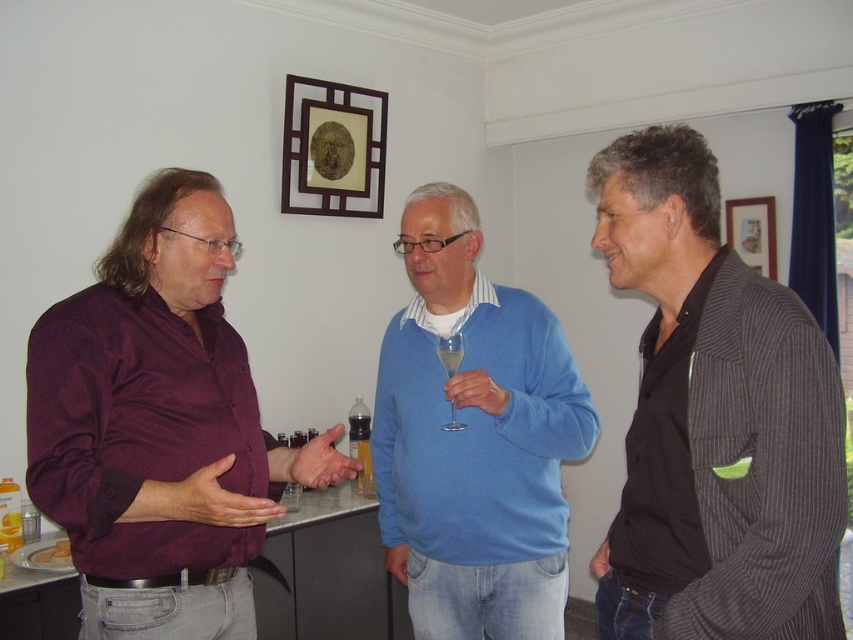
You are standing in the kitchen and want to hang a new picture frame. The wooden picture frame at upper center is currently hanging at point (334,148). If you want to place your new frame 0.1 units to the right and 0.05 units higher than the existing one, what would be the new coordinates?

The new coordinates would be calculated by adding 0.1 to the x coordinate and 0.05 to the y coordinate of the wooden picture frame at upper center. The original point is (334,148). Adding 0.1 to the x gives 0.333, and adding 0.05 to the y gives 0.442. Therefore, the new coordinates are 0.333, 0.442.